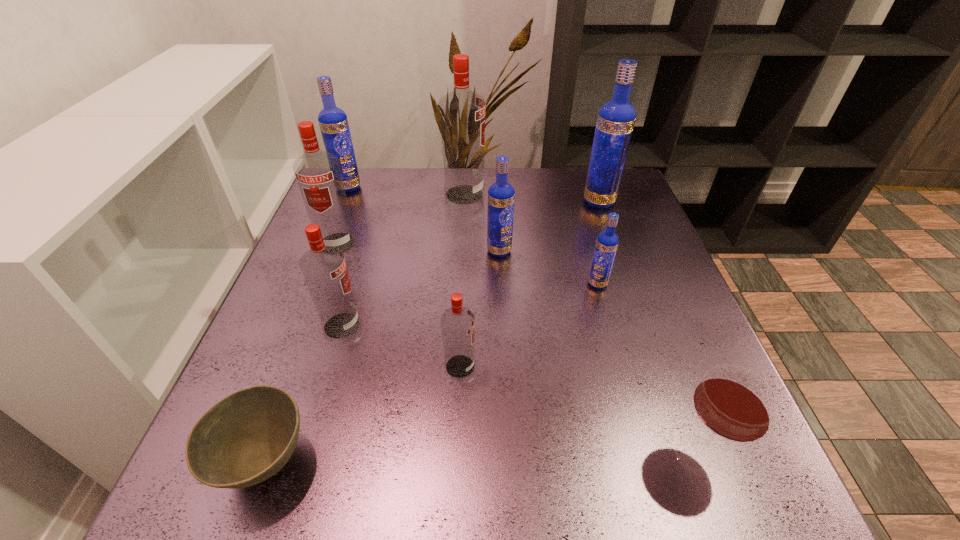
Find the location of a particular element. The image size is (960, 540). empty space between the second biggest red vodka and the third nearest vodka is located at coordinates (468, 264).

Locate an element on the screen. free spot between the biggest red vodka and the second nearest blue vodka is located at coordinates (482, 222).

Image resolution: width=960 pixels, height=540 pixels. I want to click on vacant space that is in between the third biggest red vodka and the farthest red vodka, so click(403, 260).

Identify the location of empty location between the second farthest red vodka and the red wineglass. Image resolution: width=960 pixels, height=540 pixels. (517, 349).

Locate an element on the screen. free space between the third smallest red vodka and the wineglass is located at coordinates (517, 349).

Find the location of a particular element. free spot between the wineglass and the third smallest red vodka is located at coordinates [517, 349].

The image size is (960, 540). I want to click on free space that is in between the farthest red vodka and the wineglass, so coord(581,325).

Identify which object is the second closest to the rightmost vodka. Please provide its 2D coordinates. Your answer should be formatted as a tuple, i.e. [(x, y)], where the tuple contains the x and y coordinates of a point satisfying the conditions above.

[(607, 242)]

Locate which object ranks ninth in proximity to the second smallest blue vodka. Please provide its 2D coordinates. Your answer should be formatted as a tuple, i.e. [(x, y)], where the tuple contains the x and y coordinates of a point satisfying the conditions above.

[(247, 437)]

Identify which vodka is located as the sixth nearest to the rightmost blue vodka. Please provide its 2D coordinates. Your answer should be formatted as a tuple, i.e. [(x, y)], where the tuple contains the x and y coordinates of a point satisfying the conditions above.

[(333, 122)]